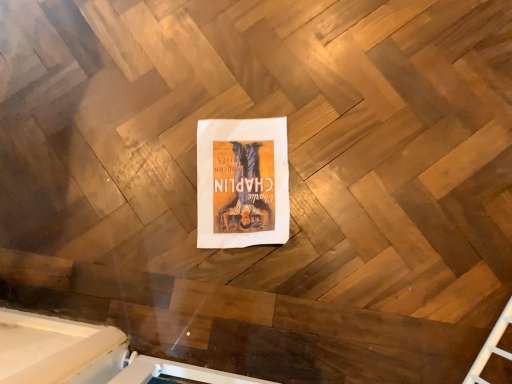
Locate an element on the screen. This screenshot has height=384, width=512. white paper poster at center is located at coordinates (242, 182).

What is the approximate height of white paper poster at center?

white paper poster at center is 0.39 inches tall.

Measure the distance between point (234, 176) and camera.

Point (234, 176) is 38.07 inches away from camera.

This screenshot has height=384, width=512. What do you see at coordinates (242, 182) in the screenshot?
I see `white paper poster at center` at bounding box center [242, 182].

Where is `white paper poster at center`? Image resolution: width=512 pixels, height=384 pixels. white paper poster at center is located at coordinates (242, 182).